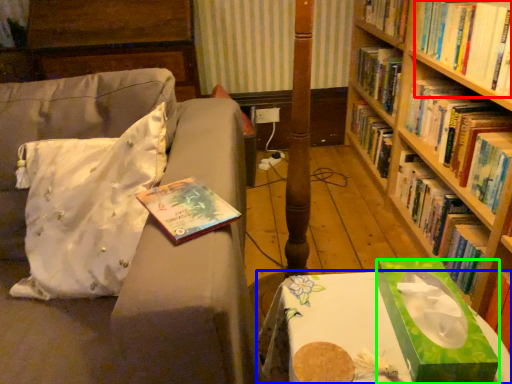
Question: Based on their relative distances, which object is farther from book (highlighted by a red box)? Choose from table (highlighted by a blue box) and book cover (highlighted by a green box).

Choices:
 (A) table
 (B) book cover

Answer: (A)